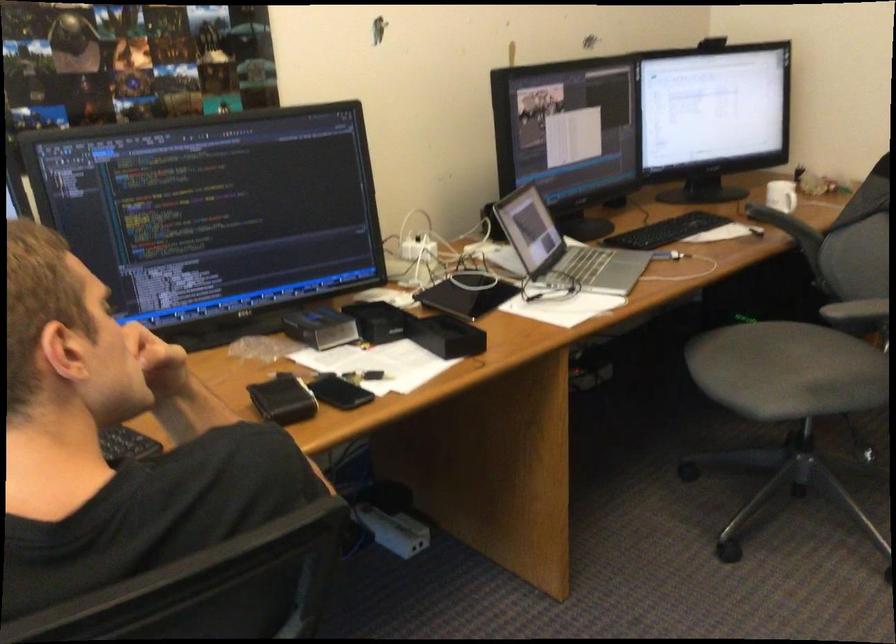
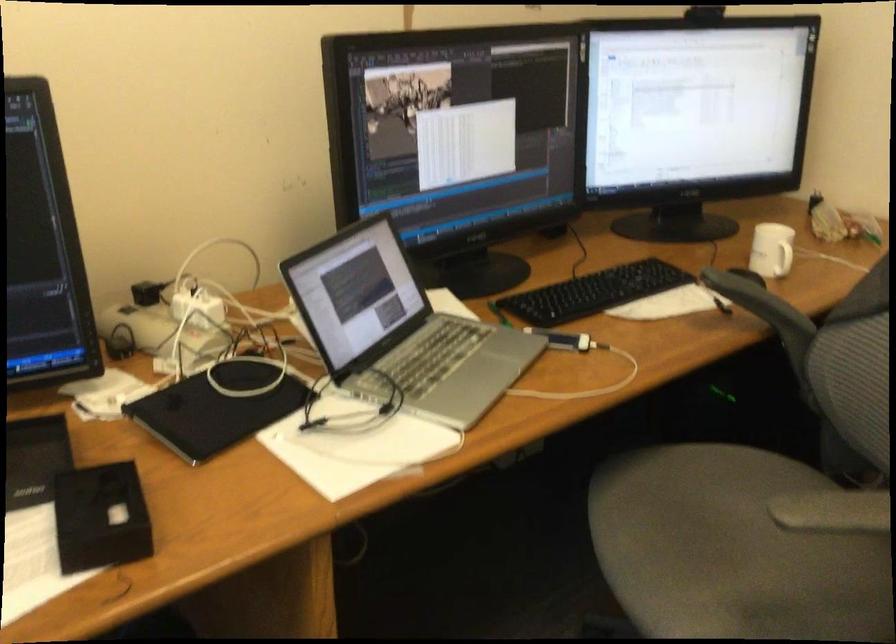
In a continuous first-person perspective shot, in which direction is the camera moving?

The movement direction of the cameraman is right, forward.